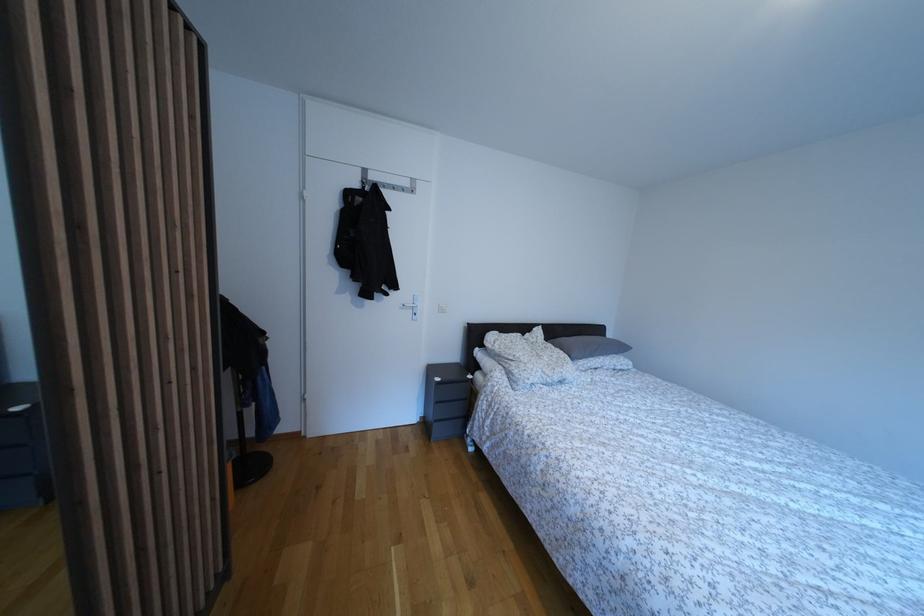
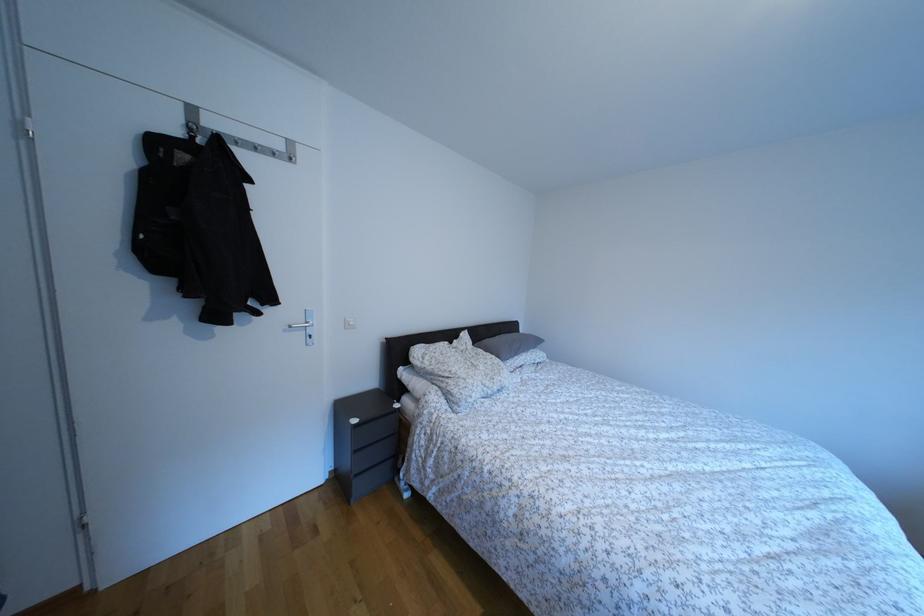
Which direction would the cameraman need to move to produce the second image?

The cameraman walked toward left, forward.